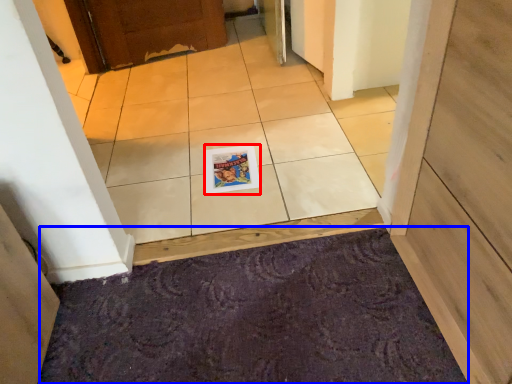
Question: Which of the following is the farthest to the observer, magazine (highlighted by a red box) or doormat (highlighted by a blue box)?

Choices:
 (A) magazine
 (B) doormat

Answer: (A)